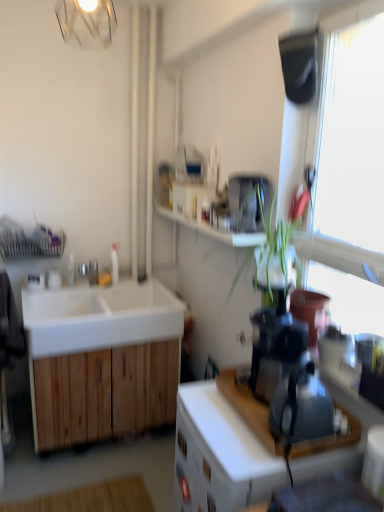
Question: Considering their positions, is black plastic blender at right, which is the 2th appliance from back to front, located in front of or behind dark gray fabric swivel chair at left?

Choices:
 (A) front
 (B) behind

Answer: (A)

Question: Is point pos(324,430) closer or farther from the camera than point pos(8,365)?

Choices:
 (A) closer
 (B) farther

Answer: (A)

Question: Based on their relative distances, which object is nearer to the white matte drawer at center?

Choices:
 (A) metallic silver toaster at upper center, acting as the first appliance starting from the top
 (B) black plastic blender at right, which ranks as the second appliance in top-to-bottom order
 (C) transparent glass window at upper right
 (D) dark gray fabric swivel chair at left
 (E) clear glass light fixture at upper center

Answer: (B)

Question: Which of these objects is positioned farthest from the white wood cabinet at left, which is the second cabinetry from right to left?

Choices:
 (A) metallic silver toaster at upper center, acting as the first appliance starting from the top
 (B) white matte sink at left
 (C) white matte drawer at center
 (D) black plastic blender at right, which is the 2th appliance from back to front
 (E) transparent glass window at upper right

Answer: (E)